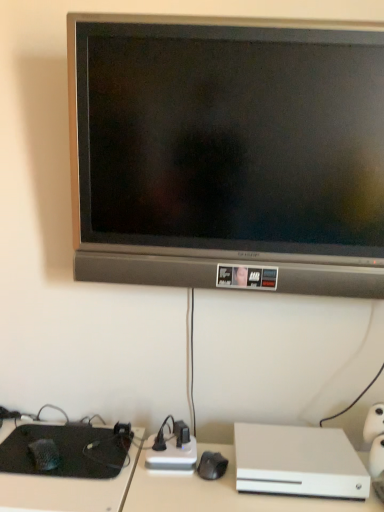
Question: Is white matte xbox one at lower right thinner than matte black tv at upper center?

Choices:
 (A) no
 (B) yes

Answer: (A)

Question: Can you confirm if white matte xbox one at lower right is positioned to the right of matte black tv at upper center?

Choices:
 (A) no
 (B) yes

Answer: (B)

Question: Is white matte xbox one at lower right taller than matte black tv at upper center?

Choices:
 (A) yes
 (B) no

Answer: (B)

Question: Would you consider white matte xbox one at lower right to be distant from matte black tv at upper center?

Choices:
 (A) yes
 (B) no

Answer: (B)

Question: Considering the relative sizes of white matte xbox one at lower right and matte black tv at upper center in the image provided, is white matte xbox one at lower right shorter than matte black tv at upper center?

Choices:
 (A) yes
 (B) no

Answer: (A)

Question: Is matte black tv at upper center inside or outside of white matte xbox one at lower right?

Choices:
 (A) outside
 (B) inside

Answer: (A)

Question: Considering the relative positions of matte black tv at upper center and white matte xbox one at lower right in the image provided, is matte black tv at upper center to the left or to the right of white matte xbox one at lower right?

Choices:
 (A) right
 (B) left

Answer: (B)

Question: From the image's perspective, is matte black tv at upper center located above or below white matte xbox one at lower right?

Choices:
 (A) above
 (B) below

Answer: (A)

Question: Considering the positions of point (251, 129) and point (248, 433), is point (251, 129) closer or farther from the camera than point (248, 433)?

Choices:
 (A) closer
 (B) farther

Answer: (A)

Question: Is white matte xbox one at lower right bigger or smaller than matte black tv at upper center?

Choices:
 (A) small
 (B) big

Answer: (A)

Question: Is white matte xbox one at lower right in front of or behind matte black tv at upper center in the image?

Choices:
 (A) behind
 (B) front

Answer: (A)

Question: Considering the positions of white matte xbox one at lower right and matte black tv at upper center in the image, is white matte xbox one at lower right taller or shorter than matte black tv at upper center?

Choices:
 (A) tall
 (B) short

Answer: (B)

Question: Is white matte xbox one at lower right spatially inside matte black tv at upper center, or outside of it?

Choices:
 (A) inside
 (B) outside

Answer: (B)

Question: Relative to matte black tv at upper center, is black matte keyboard at lower left in front or behind?

Choices:
 (A) behind
 (B) front

Answer: (A)

Question: From the image's perspective, is black matte keyboard at lower left located above or below matte black tv at upper center?

Choices:
 (A) below
 (B) above

Answer: (A)